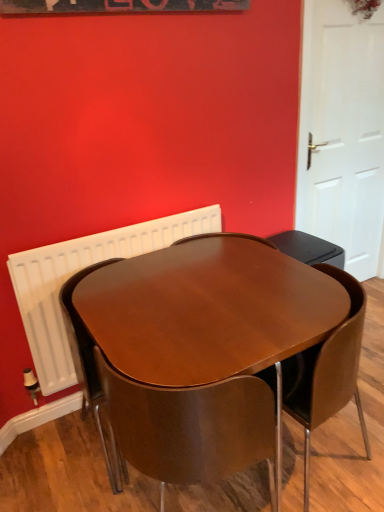
Image resolution: width=384 pixels, height=512 pixels. Identify the location of free location above wooden chair at center, arranged as the 2th chair when viewed from the right (from a real-world perspective). pos(168,353).